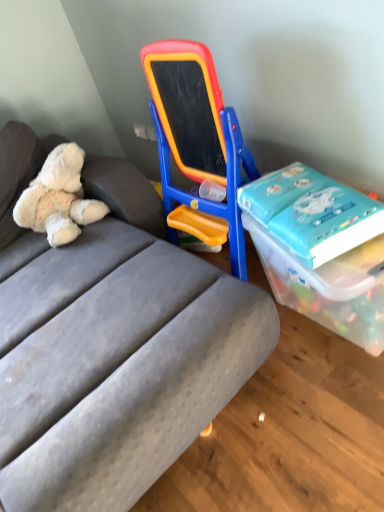
Question: Is white plush teddy bear at left oriented towards blue glossy book at right?

Choices:
 (A) no
 (B) yes

Answer: (B)

Question: Does white plush teddy bear at left have a larger size compared to blue glossy book at right?

Choices:
 (A) no
 (B) yes

Answer: (B)

Question: Is white plush teddy bear at left beside blue glossy book at right?

Choices:
 (A) no
 (B) yes

Answer: (A)

Question: From the image's perspective, is white plush teddy bear at left under blue glossy book at right?

Choices:
 (A) yes
 (B) no

Answer: (B)

Question: Is white plush teddy bear at left at the left side of blue glossy book at right?

Choices:
 (A) yes
 (B) no

Answer: (A)

Question: Does white plush teddy bear at left come behind blue glossy book at right?

Choices:
 (A) yes
 (B) no

Answer: (A)

Question: Is gray fabric studio couch at center completely or partially outside of transparent plastic box at right?

Choices:
 (A) yes
 (B) no

Answer: (A)

Question: Can you confirm if gray fabric studio couch at center is taller than transparent plastic box at right?

Choices:
 (A) no
 (B) yes

Answer: (B)

Question: Considering the relative sizes of gray fabric studio couch at center and transparent plastic box at right in the image provided, is gray fabric studio couch at center thinner than transparent plastic box at right?

Choices:
 (A) no
 (B) yes

Answer: (A)

Question: Is gray fabric studio couch at center looking in the opposite direction of transparent plastic box at right?

Choices:
 (A) no
 (B) yes

Answer: (B)

Question: Can you confirm if gray fabric studio couch at center is positioned to the right of transparent plastic box at right?

Choices:
 (A) yes
 (B) no

Answer: (B)

Question: Considering the relative sizes of gray fabric studio couch at center and transparent plastic box at right in the image provided, is gray fabric studio couch at center smaller than transparent plastic box at right?

Choices:
 (A) yes
 (B) no

Answer: (B)

Question: From a real-world perspective, does transparent plastic box at right stand above blue glossy book at right?

Choices:
 (A) yes
 (B) no

Answer: (B)